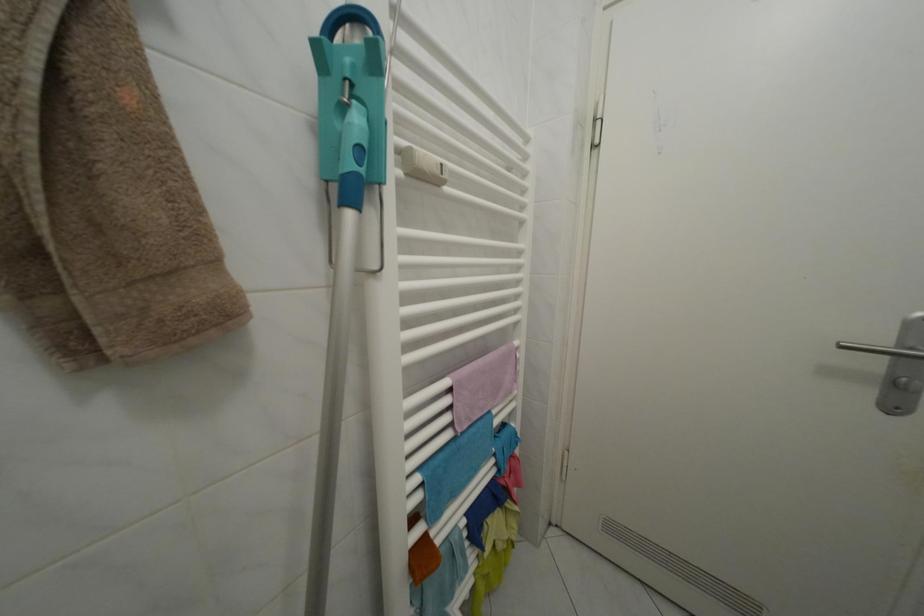
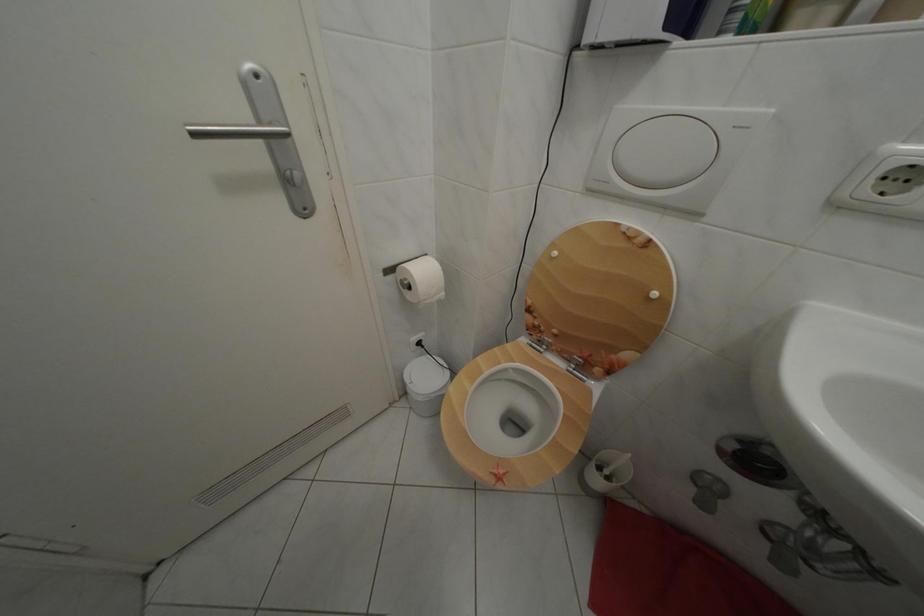
The images are taken continuously from a first-person perspective. In which direction is your viewpoint rotating?

The rotation direction of the camera is right-down.